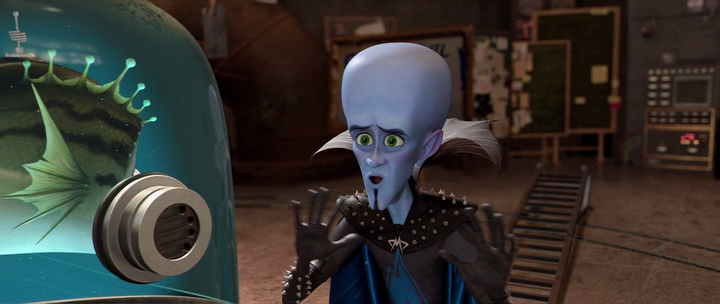
You are a GUI agent. You are given a task and a screenshot of the screen. Output one action in this format:
    pyautogui.click(x=<x>, y=<y>)
    Task: Click on the stairs
    
    Given the screenshot: What is the action you would take?
    pyautogui.click(x=535, y=233)